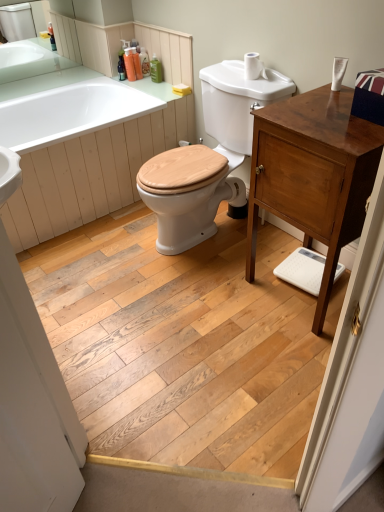
Find the location of `free space that is in between white glossy sink at upper center, acting as the first sink starting from the front, and shiny brown cabinet at right`. free space that is in between white glossy sink at upper center, acting as the first sink starting from the front, and shiny brown cabinet at right is located at coordinates (244, 283).